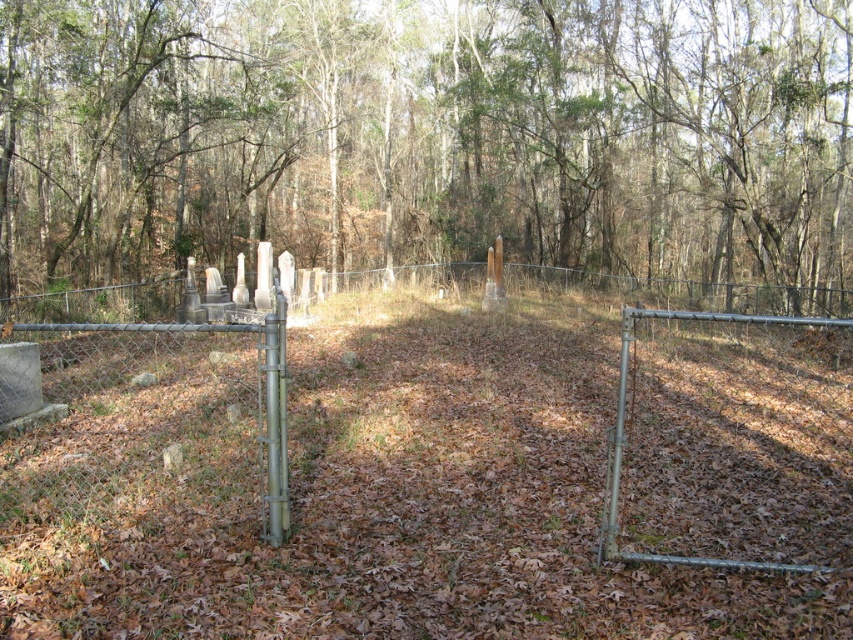
Does metal chain-link fence at center have a lesser width compared to rusty chain-link fence at center?

No.

Is metal chain-link fence at center shorter than rusty chain-link fence at center?

No, metal chain-link fence at center is not shorter than rusty chain-link fence at center.

Is point (709, 456) farther from viewer compared to point (146, 444)?

No.

At what (x,y) coordinates should I click in order to perform the action: click on metal chain-link fence at center. Please return your answer as a coordinate pair (x, y). The height and width of the screenshot is (640, 853). Looking at the image, I should click on (433, 424).

In the scene shown: Does green leafy tree at center have a lesser width compared to rusty chain-link fence at center?

In fact, green leafy tree at center might be wider than rusty chain-link fence at center.

In the scene shown: Is green leafy tree at center smaller than rusty chain-link fence at center?

Actually, green leafy tree at center might be larger than rusty chain-link fence at center.

The height and width of the screenshot is (640, 853). Describe the element at coordinates (427, 134) in the screenshot. I see `green leafy tree at center` at that location.

In order to click on green leafy tree at center in this screenshot , I will do `click(427, 134)`.

Who is more distant from viewer, (186,205) or (465,317)?

Positioned behind is point (186,205).

Can you confirm if green leafy tree at center is thinner than metal chain-link fence at center?

In fact, green leafy tree at center might be wider than metal chain-link fence at center.

Who is more forward, [35,282] or [421,547]?

Point [421,547] is in front.

At what (x,y) coordinates should I click in order to perform the action: click on green leafy tree at center. Please return your answer as a coordinate pair (x, y). This screenshot has height=640, width=853. Looking at the image, I should click on (427, 134).